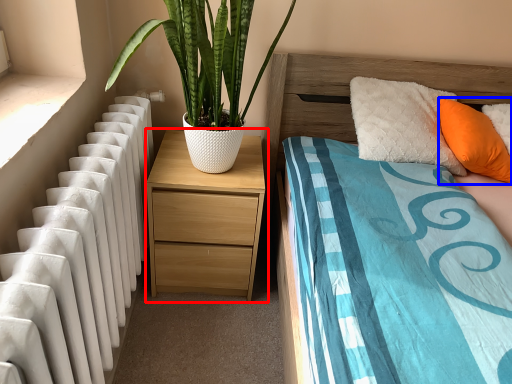
Question: Which object appears farthest to the camera in this image, nightstand (highlighted by a red box) or pillow (highlighted by a blue box)?

Choices:
 (A) nightstand
 (B) pillow

Answer: (A)